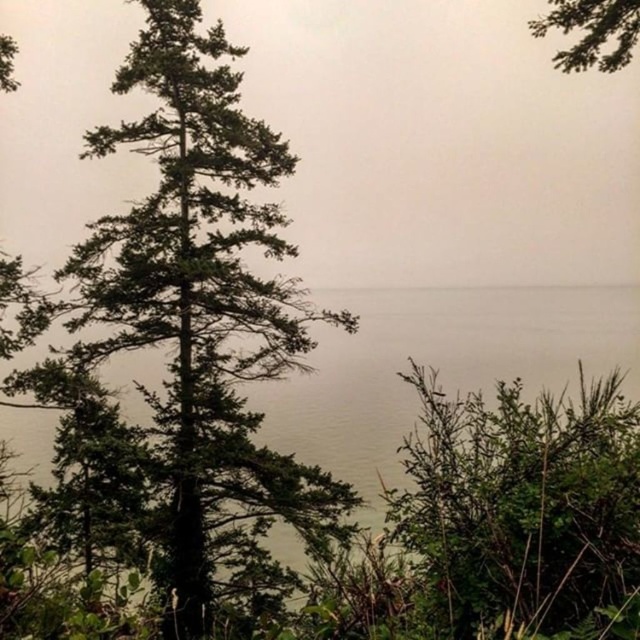
You are standing at the point with coordinates (186, 339) in the scene. What do you see directly in front of you?

You see the green needle like foliage at center left directly in front of you at point (186, 339).